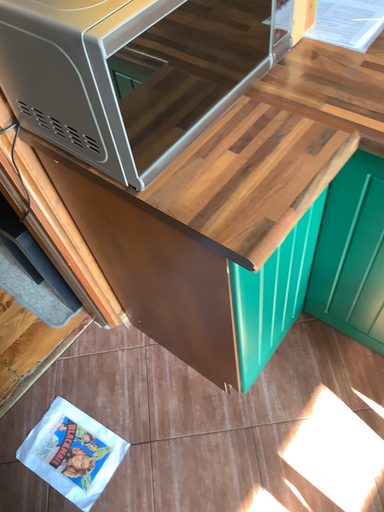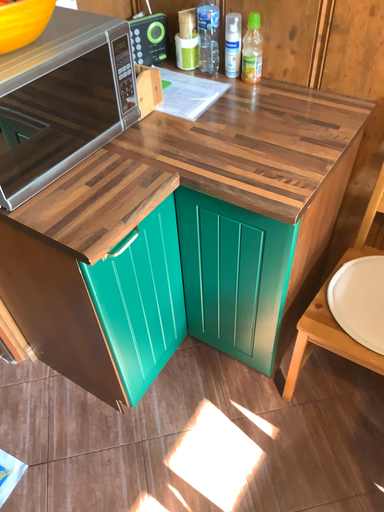
Question: Which way did the camera rotate in the video?

Choices:
 (A) rotated upward
 (B) rotated downward

Answer: (A)